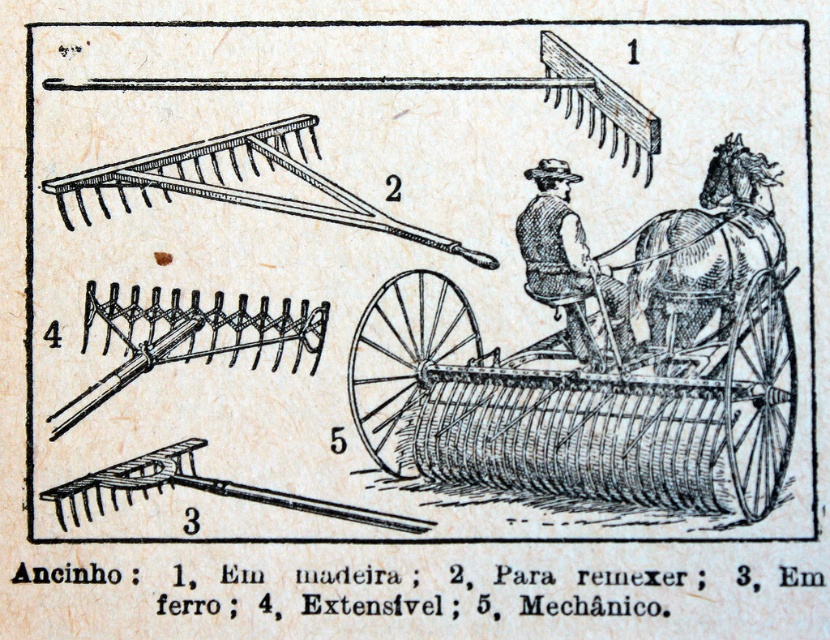
You are an inspector checking the size of items in the illustration. The wooden cart at center and the brown leather vest at center are both in your line of sight. Which item is bigger?

The wooden cart at center is larger in size than the brown leather vest at center, so the wooden cart at center is bigger.

From the picture: You are standing in front of the scene depicted in the image. You want to approach the wooden cart at center and the brown textured horse at upper right. Which one will you reach first?

You will reach the wooden cart at center first because it is closer to you than the brown textured horse at upper right.